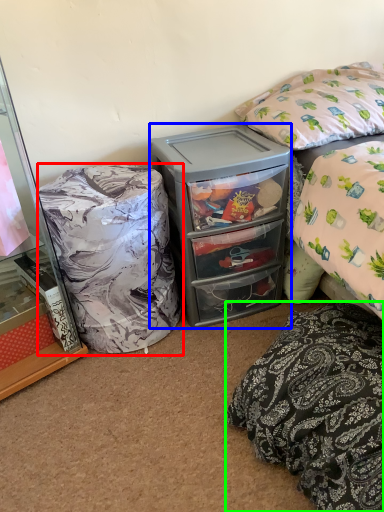
Question: Which object is the farthest from bean bag chair (highlighted by a red box)? Choose among these: cooler (highlighted by a blue box) or pillow (highlighted by a green box).

Choices:
 (A) cooler
 (B) pillow

Answer: (B)